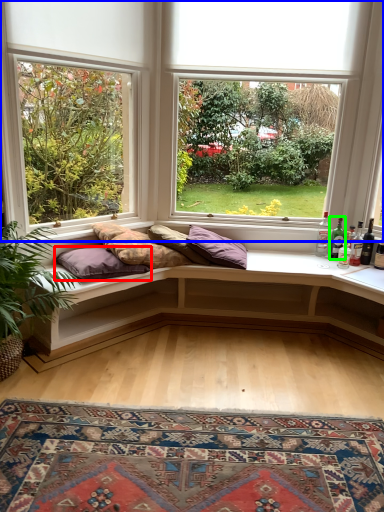
Question: Considering the real-world distances, which object is closest to pillow (highlighted by a red box)? window (highlighted by a blue box) or bottle (highlighted by a green box).

Choices:
 (A) window
 (B) bottle

Answer: (A)